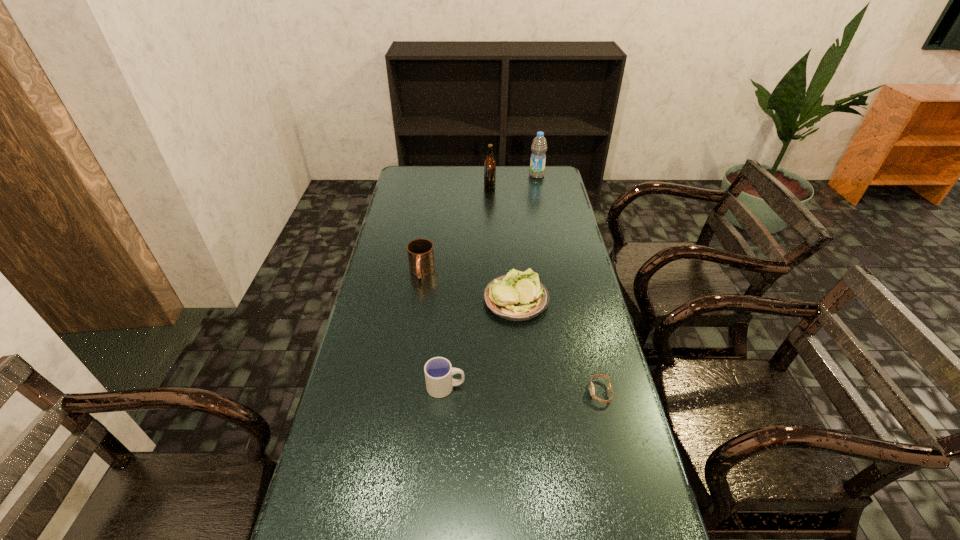
Locate an element on the screen. This screenshot has height=540, width=960. the farthest object is located at coordinates (539, 146).

Where is `beer bottle`? beer bottle is located at coordinates (489, 164).

Identify the location of the leftmost object. (420, 252).

At what (x,y) coordinates should I click in order to perform the action: click on the second object from left to right. Please return your answer as a coordinate pair (x, y). Looking at the image, I should click on (438, 371).

I want to click on lettuce, so click(x=518, y=296).

Where is `watch`? This screenshot has height=540, width=960. watch is located at coordinates click(x=592, y=390).

Where is `free location located on the back of the farthest object`? This screenshot has width=960, height=540. free location located on the back of the farthest object is located at coordinates (535, 165).

You are a GUI agent. You are given a task and a screenshot of the screen. Output one action in this format:
    pyautogui.click(x=<x>, y=<y>)
    Task: Click on the vacant space located on the label of the fifth nearest object
    This screenshot has width=960, height=540.
    Given the screenshot: What is the action you would take?
    pyautogui.click(x=460, y=186)

At what (x,y) coordinates should I click in order to perform the action: click on blank space located 0.400m on the label of the fifth nearest object. Please return your answer as a coordinate pair (x, y). This screenshot has width=960, height=540. Looking at the image, I should click on (397, 186).

This screenshot has width=960, height=540. I want to click on vacant point located on the label of the fifth nearest object, so click(444, 186).